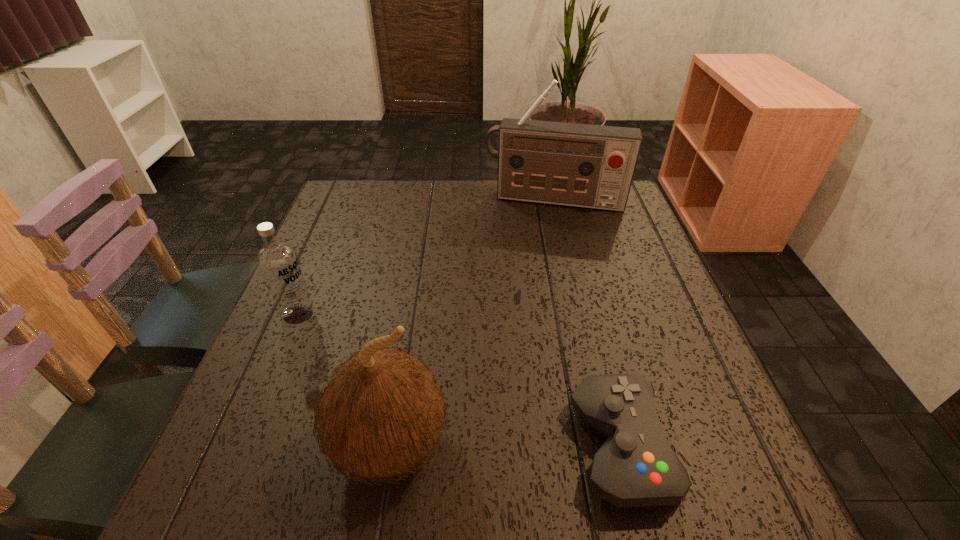
Where is `object at the near right corner`? object at the near right corner is located at coordinates (635, 467).

At what (x,y) coordinates should I click in order to perform the action: click on blank space at the far edge. Please return your answer as a coordinate pair (x, y). The width and height of the screenshot is (960, 540). Looking at the image, I should click on (418, 179).

At what (x,y) coordinates should I click in order to perform the action: click on free space at the left edge of the desktop. Please return your answer as a coordinate pair (x, y). Looking at the image, I should click on (320, 230).

At what (x,y) coordinates should I click in order to perform the action: click on free space at the right edge of the desktop. Please return your answer as a coordinate pair (x, y). This screenshot has height=540, width=960. Looking at the image, I should click on (645, 274).

Image resolution: width=960 pixels, height=540 pixels. In order to click on vacant region at the far left corner of the desktop in this screenshot , I will do `click(331, 217)`.

The height and width of the screenshot is (540, 960). In order to click on free space at the near left corner in this screenshot , I will do `click(312, 422)`.

Where is `free region at the far right corner`? This screenshot has width=960, height=540. free region at the far right corner is located at coordinates (630, 223).

This screenshot has width=960, height=540. Find the location of `vacant space that is in between the third shortest object and the control`. vacant space that is in between the third shortest object and the control is located at coordinates (505, 446).

Where is `empty location between the shortest object and the leftmost object`? Image resolution: width=960 pixels, height=540 pixels. empty location between the shortest object and the leftmost object is located at coordinates (459, 380).

You are a GUI agent. You are given a task and a screenshot of the screen. Output one action in this format:
    pyautogui.click(x=<x>, y=<y>)
    Task: Click on the empty space that is in between the radio receiver and the control
    The width and height of the screenshot is (960, 540).
    Given the screenshot: What is the action you would take?
    pyautogui.click(x=587, y=323)